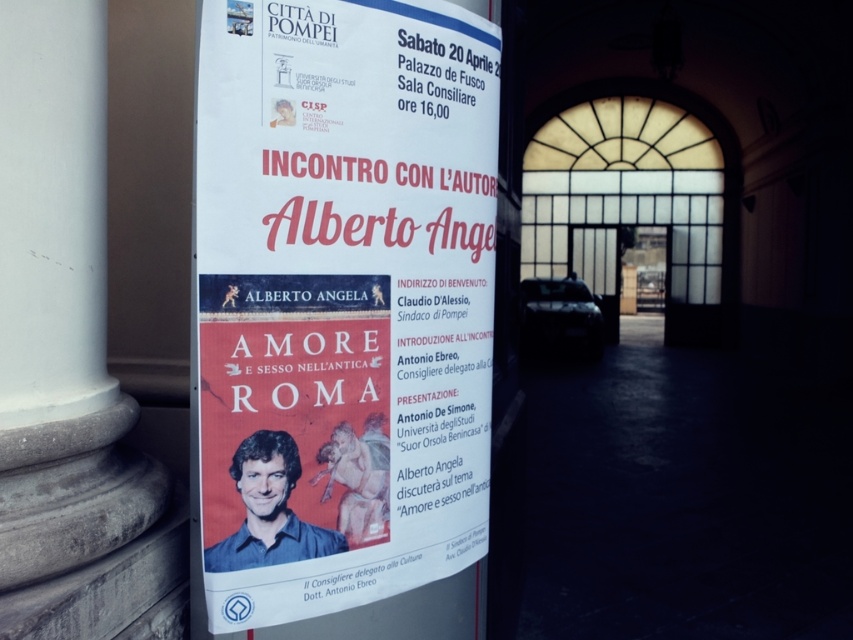
You are standing in front of the event poster for Alberto Angela. The point marked at coordinates [474,81] on the poster is where the event date is located. If you want to touch this date with your hand, which is 0.5 meters away from your eyes, can you reach it without moving your body?

The point at [474,81] is 1.77 meters away from you. Since your hand can only reach up to 0.5 meters from your eyes, you cannot reach the date without moving your body.

You are an event organizer checking the visibility of the white paper poster at center and the white marble pillar at left from across the square. Based on their heights, which one is more likely to be seen first when approaching the column from a distance?

The white paper poster at center is taller than the white marble pillar at left, so it will be visible first when approaching from a distance.